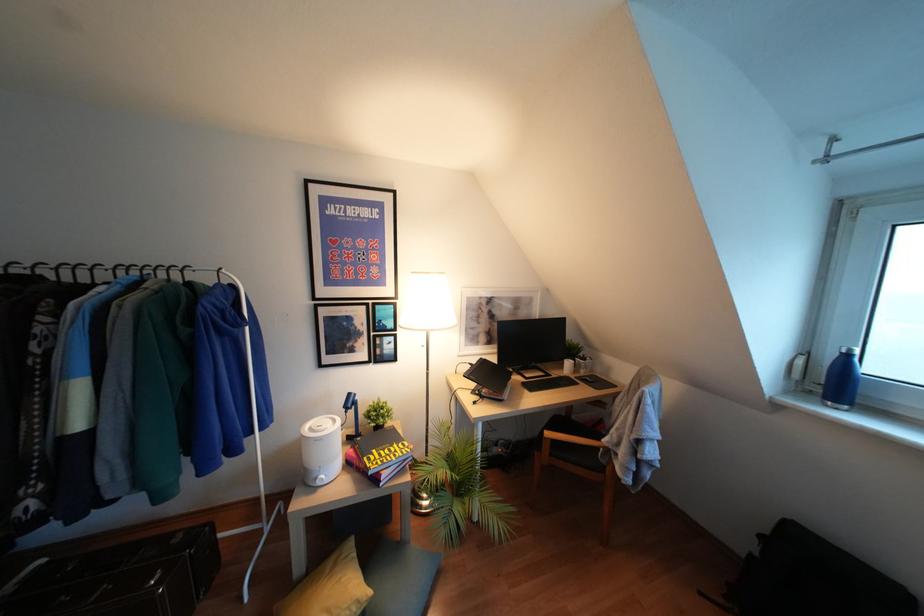
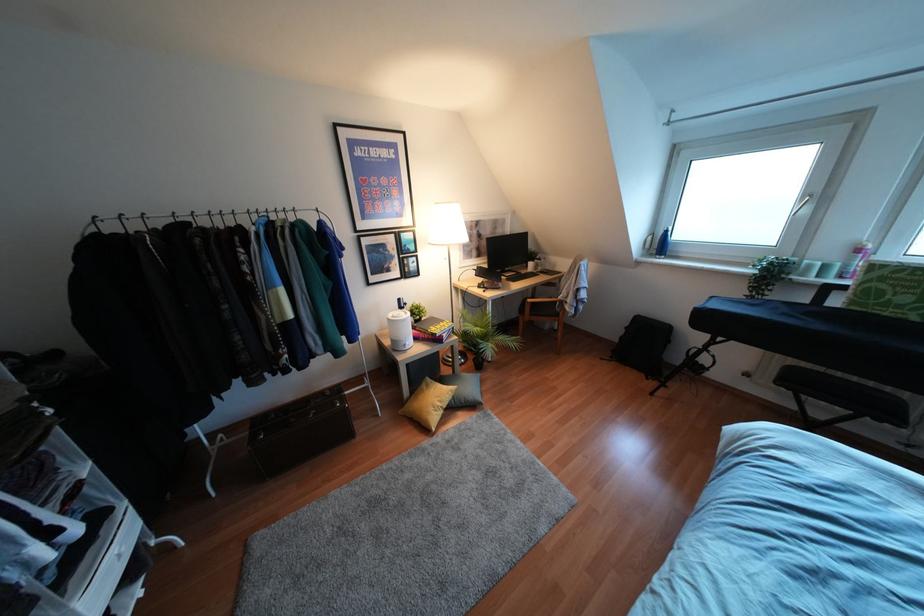
Where in the second image is the point corresponding to the point at 319,483 from the first image?

(407, 347)